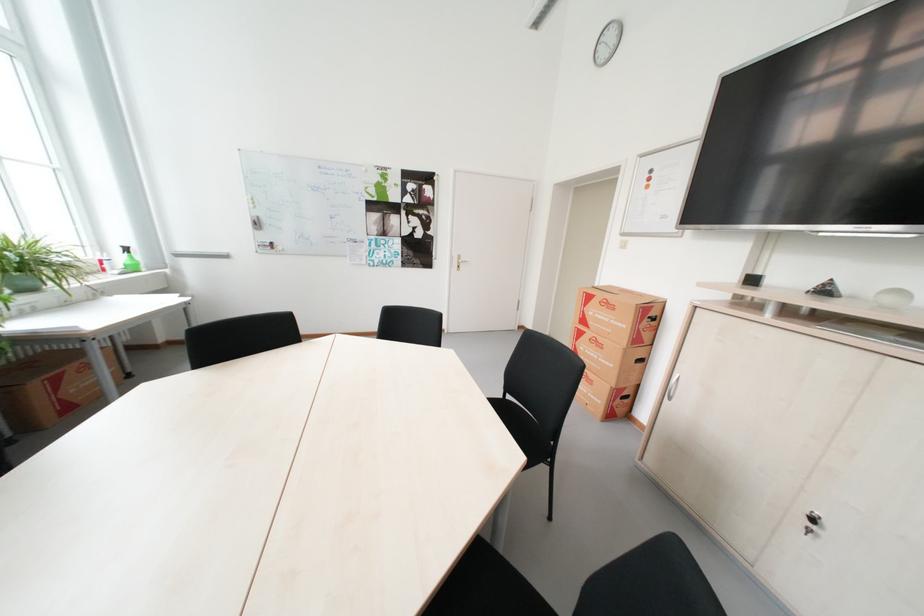
I want to click on glass sphere object, so click(893, 297).